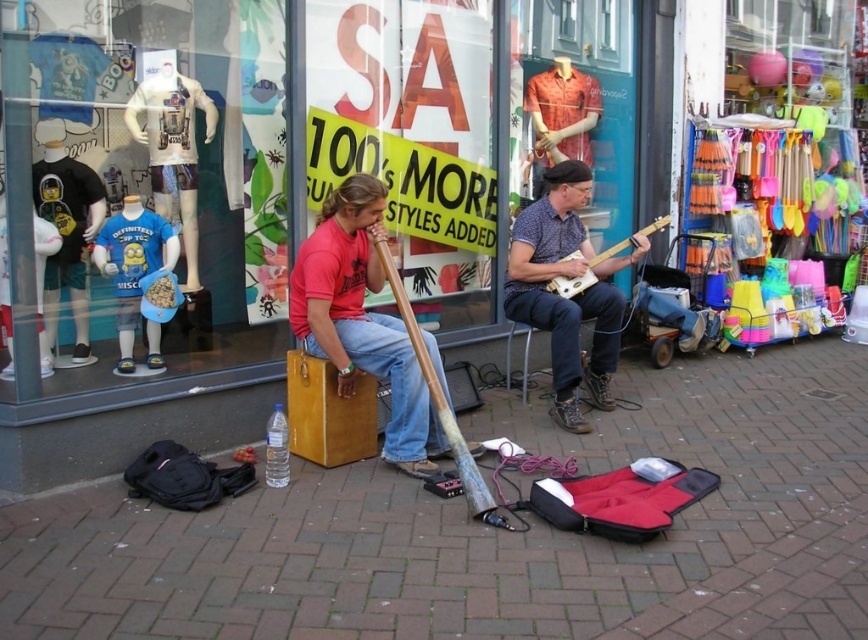
You are a delivery person who needs to place a large box on the brick pavement at center. However, there is a matte plastic mannequin at upper left nearby. Can you safely place the box there without moving the mannequin? Please explain based on the distance between them.

The brick pavement at center and matte plastic mannequin at upper left are 4.77 feet apart. Since the distance is sufficient, you can safely place the box on the brick pavement at center without moving the matte plastic mannequin at upper left.

You are standing in front of the store and want to determine which of the two points, point (396, 284) or point (666, 225), is nearer to you. Based on the scene description, which point is closer?

Point (396, 284) is closer to the viewer than point (666, 225).

You are a customer looking at the storefront display. You see the blue denim jeans at center and the wooden stick at center. Which item is located to the right of the other?

The blue denim jeans at center is positioned on the right side of wooden stick at center, so the blue denim jeans at center is to the right of the wooden stick at center.